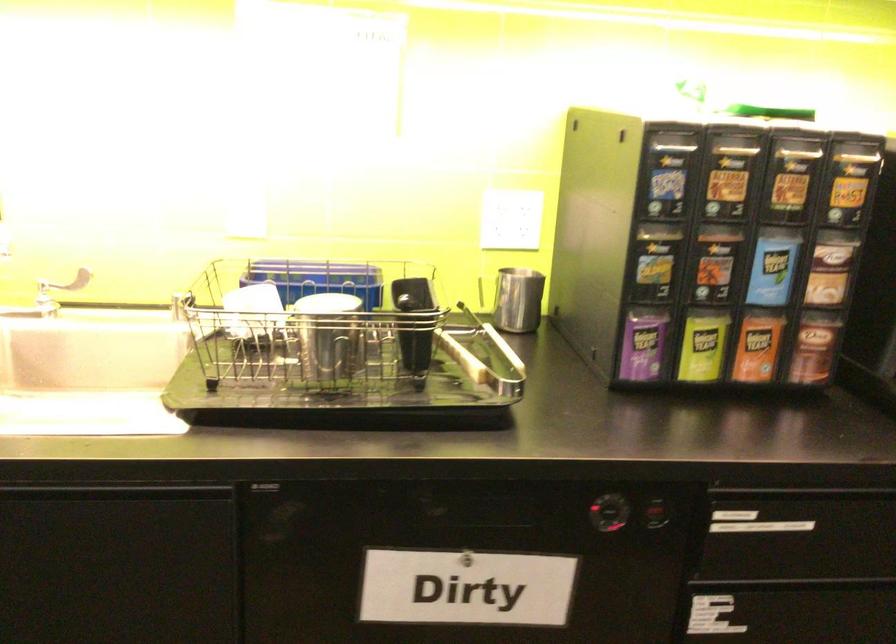
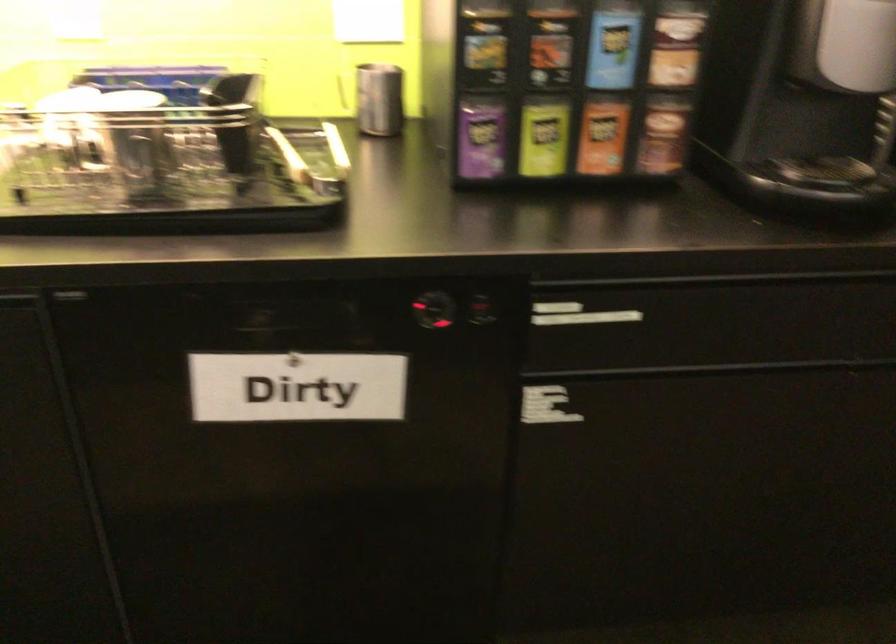
In the second image, find the point that corresponds to [352,354] in the first image.

(164, 156)